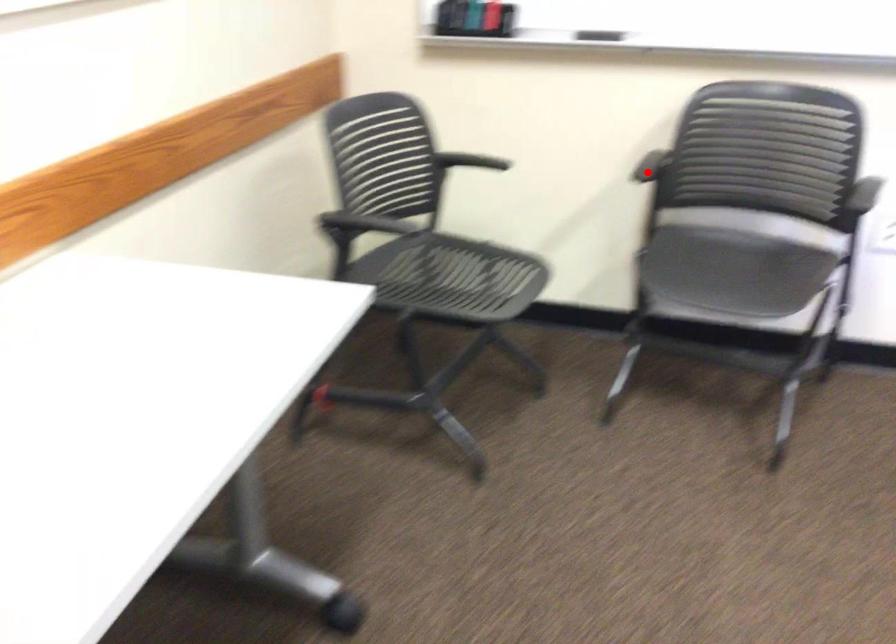
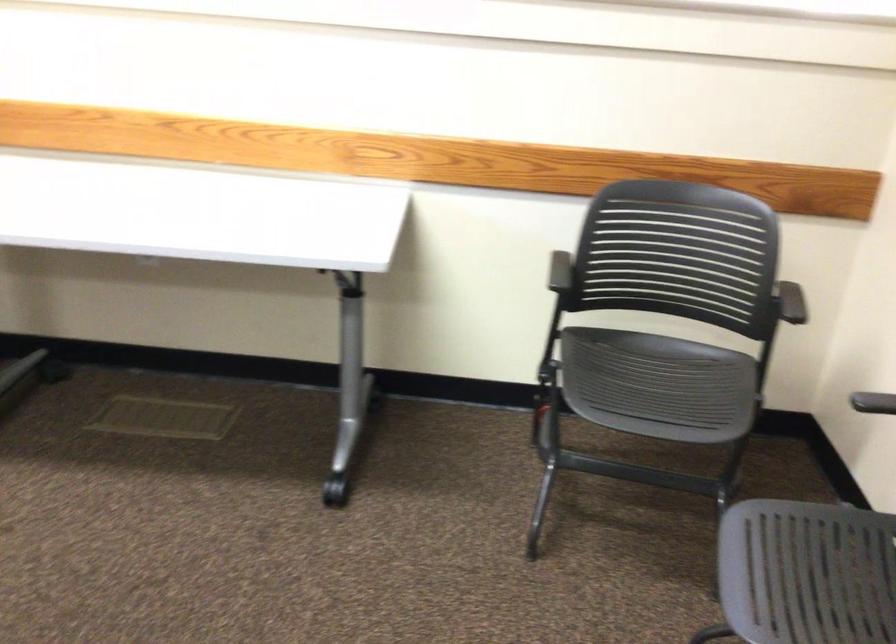
In the second image, find the point that corresponds to the highlighted location in the first image.

(873, 402)